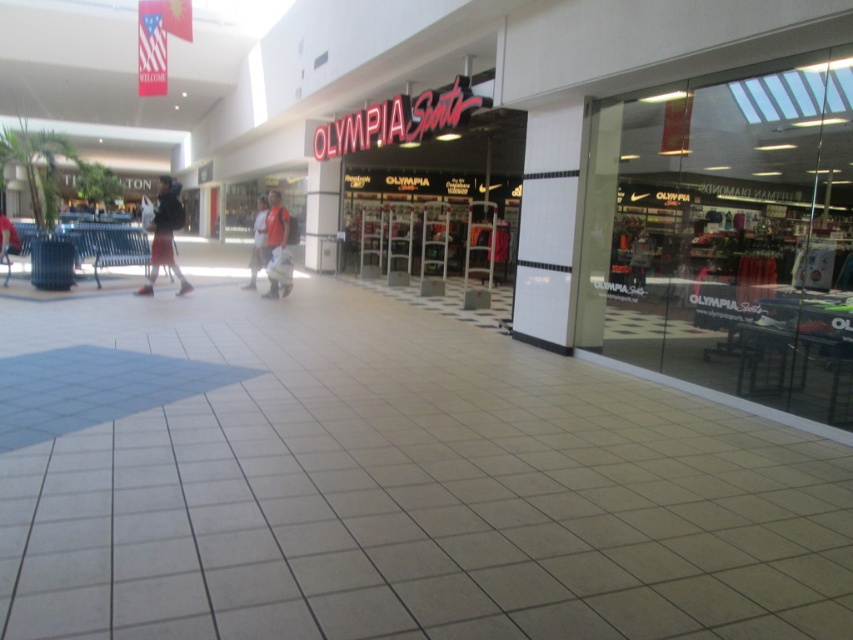
Question: Observing the image, what is the correct spatial positioning of dark gray backpack at center in reference to reddish-brown fabric pants at center?

Choices:
 (A) below
 (B) above

Answer: (B)

Question: Among these points, which one is farthest from the camera?

Choices:
 (A) (271, 216)
 (B) (264, 212)

Answer: (B)

Question: Estimate the real-world distances between objects in this image. Which object is farther from the red shirt at center?

Choices:
 (A) reddish-brown fabric pants at center
 (B) dark gray backpack at center

Answer: (B)

Question: Does dark gray backpack at center appear over reddish-brown fabric pants at center?

Choices:
 (A) no
 (B) yes

Answer: (B)

Question: Can you confirm if dark gray backpack at center is bigger than reddish-brown fabric pants at center?

Choices:
 (A) no
 (B) yes

Answer: (B)

Question: Which of the following is the closest to the observer?

Choices:
 (A) (152, 240)
 (B) (276, 294)

Answer: (A)